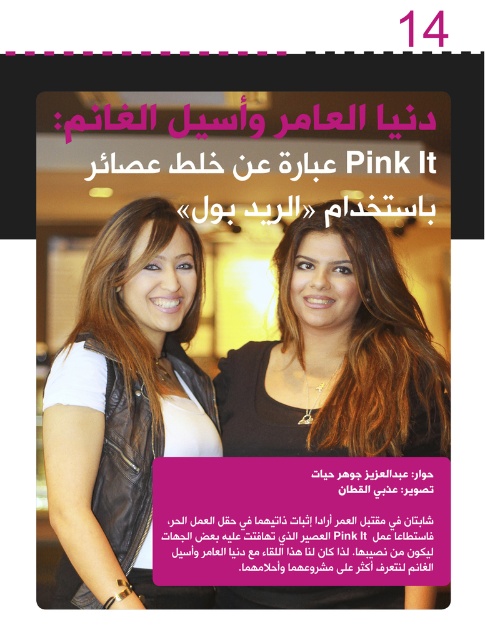
Is matte black vest at center closer to camera compared to pink matte text at center?

No, it is not.

Does point (433, 387) come farther from viewer compared to point (308, 481)?

Yes, point (433, 387) is behind point (308, 481).

The width and height of the screenshot is (485, 640). Find the location of `matte black vest at center`. matte black vest at center is located at coordinates (338, 353).

Does leather jacket at center appear on the right side of pink matte text at center?

Incorrect, leather jacket at center is not on the right side of pink matte text at center.

Is leather jacket at center positioned before pink matte text at center?

Yes, it is.

Is point (64, 371) positioned behind point (313, 468)?

No, (64, 371) is in front of (313, 468).

Find the location of `leather jacket at center`. leather jacket at center is located at coordinates (126, 406).

Where is `leather jacket at center`? This screenshot has width=485, height=640. leather jacket at center is located at coordinates (126, 406).

Identify the location of leather jacket at center. This screenshot has width=485, height=640. point(126,406).

I want to click on leather jacket at center, so click(x=126, y=406).